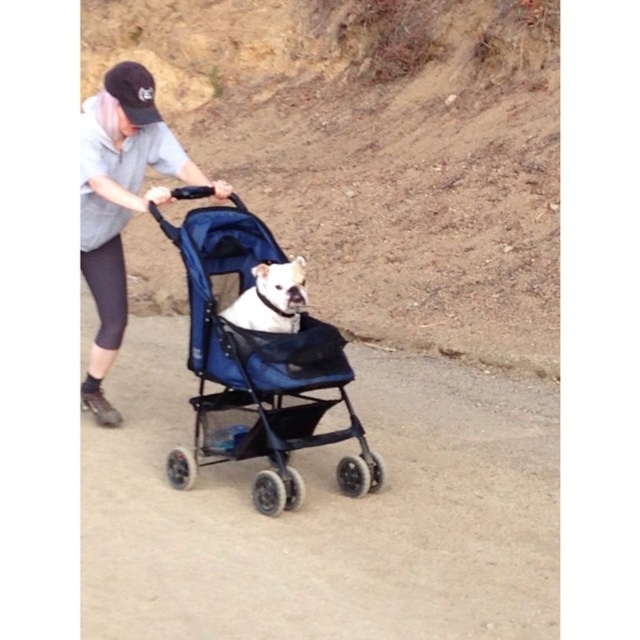
Question: Estimate the real-world distances between objects in this image. Which object is farther from the black fabric baseball cap at upper left?

Choices:
 (A) blue fabric stroller at center
 (B) white matte dog at center

Answer: (A)

Question: Is blue fabric stroller at center further to camera compared to white matte dog at center?

Choices:
 (A) no
 (B) yes

Answer: (A)

Question: Which of the following is the closest to the observer?

Choices:
 (A) (216, 195)
 (B) (134, 112)
 (C) (243, 314)

Answer: (C)

Question: Which point is farther to the camera?

Choices:
 (A) (244, 321)
 (B) (81, 260)
 (C) (148, 118)

Answer: (B)

Question: Can you confirm if blue fabric stroller at center is bigger than white matte dog at center?

Choices:
 (A) no
 (B) yes

Answer: (B)

Question: Observing the image, what is the correct spatial positioning of white matte dog at center in reference to black fabric baseball cap at upper left?

Choices:
 (A) above
 (B) below

Answer: (B)